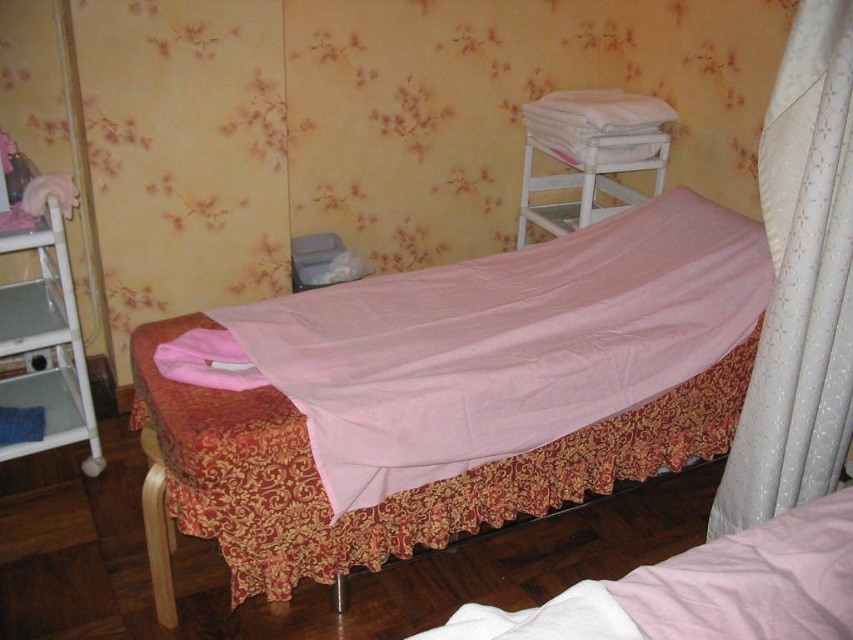
Question: Can you confirm if pink satin bed at center is thinner than matte pink fabric at left?

Choices:
 (A) no
 (B) yes

Answer: (A)

Question: Which object appears farthest from the camera in this image?

Choices:
 (A) satin white curtain at right
 (B) white wooden bunk bed at upper center
 (C) matte pink fabric at left

Answer: (B)

Question: Which object appears closest to the camera in this image?

Choices:
 (A) white wooden bunk bed at upper center
 (B) pink satin bed at center

Answer: (B)

Question: Which object is positioned closest to the matte pink fabric at left?

Choices:
 (A) pink satin bed at center
 (B) satin white curtain at right
 (C) white wooden bunk bed at upper center

Answer: (A)

Question: Can you confirm if satin white curtain at right is positioned to the left of white wooden bunk bed at upper center?

Choices:
 (A) yes
 (B) no

Answer: (B)

Question: Does satin white curtain at right have a greater width compared to white wooden bunk bed at upper center?

Choices:
 (A) yes
 (B) no

Answer: (B)